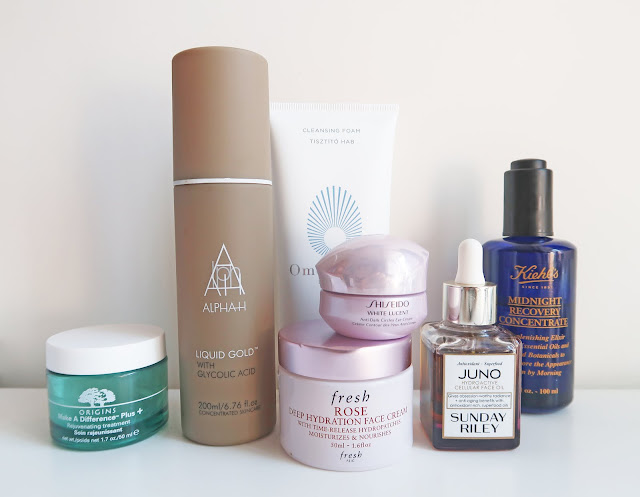
This screenshot has width=640, height=497. Find the location of `gold bottle`. gold bottle is located at coordinates (226, 211).